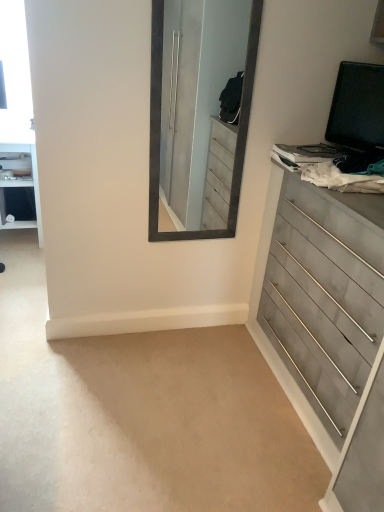
Question: In the image, is white glossy vanity at left on the left side or the right side of gray wood dresser at right?

Choices:
 (A) right
 (B) left

Answer: (B)

Question: Is point (28, 184) closer or farther from the camera than point (374, 505)?

Choices:
 (A) closer
 (B) farther

Answer: (B)

Question: Looking at the image, does white glossy vanity at left seem bigger or smaller compared to gray wood dresser at right?

Choices:
 (A) big
 (B) small

Answer: (B)

Question: Is gray wood dresser at right inside the boundaries of white glossy vanity at left, or outside?

Choices:
 (A) inside
 (B) outside

Answer: (B)

Question: Does point (324, 190) appear closer or farther from the camera than point (4, 181)?

Choices:
 (A) farther
 (B) closer

Answer: (B)

Question: Is gray wood dresser at right taller or shorter than white glossy vanity at left?

Choices:
 (A) short
 (B) tall

Answer: (B)

Question: Is gray wood dresser at right bigger or smaller than white glossy vanity at left?

Choices:
 (A) small
 (B) big

Answer: (B)